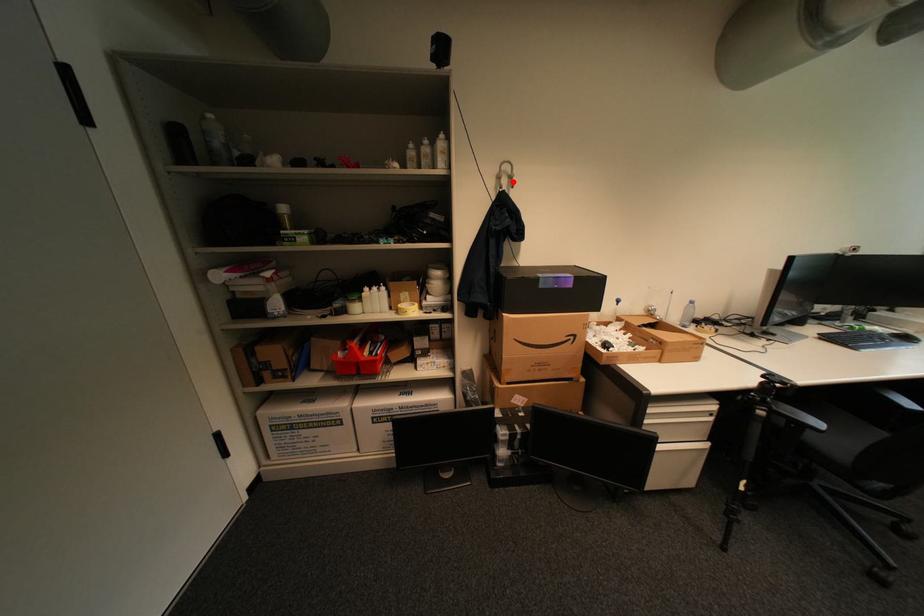
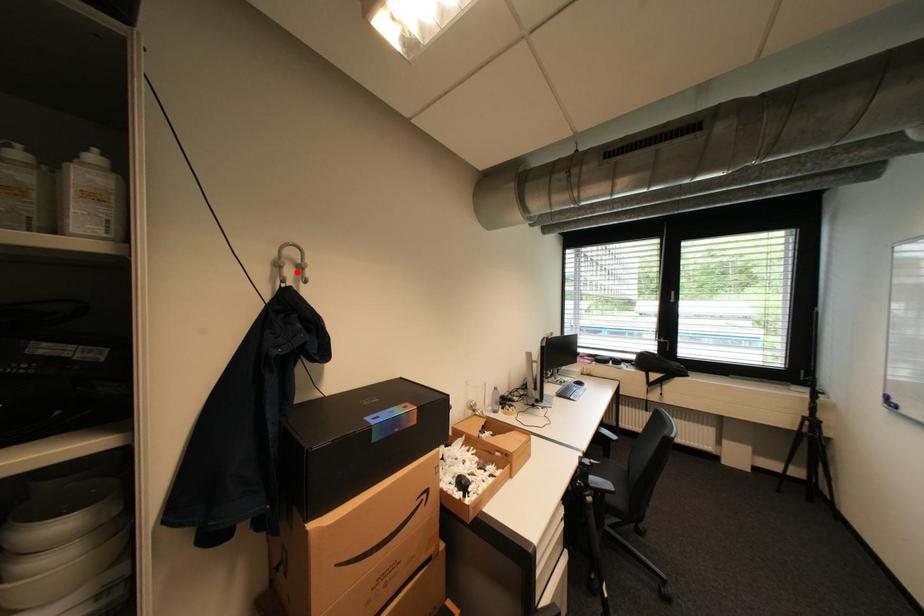
I am providing you with two images of the same scene from different viewpoints. A red point is marked on the first image and another point is marked on the second image. Do the highlighted points in image1 and image2 indicate the same real-world spot?

Yes